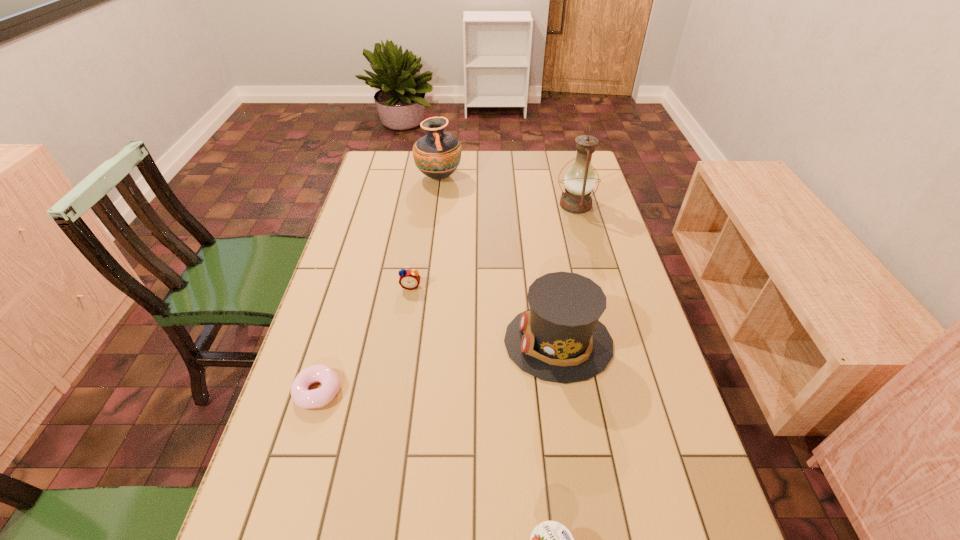
Locate an element on the screen. The image size is (960, 540). the fifth nearest object is located at coordinates (579, 181).

Where is `the tallest object`? The image size is (960, 540). the tallest object is located at coordinates (579, 181).

I want to click on the farthest object, so click(x=437, y=155).

Identify the location of pottery. (437, 155).

The width and height of the screenshot is (960, 540). I want to click on dress hat, so click(559, 339).

You are a GUI agent. You are given a task and a screenshot of the screen. Output one action in this format:
    pyautogui.click(x=<x>, y=<y>)
    Task: Click on the alarm clock
    The image size is (960, 540).
    Given the screenshot: What is the action you would take?
    pyautogui.click(x=409, y=279)

This screenshot has height=540, width=960. What are the coordinates of `the shortest object` in the screenshot? It's located at (303, 398).

Where is `the leftmost object`? The width and height of the screenshot is (960, 540). the leftmost object is located at coordinates (303, 398).

Locate an element on the screen. free space located on the front of the tallest object is located at coordinates (590, 262).

Find the location of a particular element. Image resolution: width=960 pixels, height=540 pixels. vacant region located on the left of the pottery is located at coordinates (382, 177).